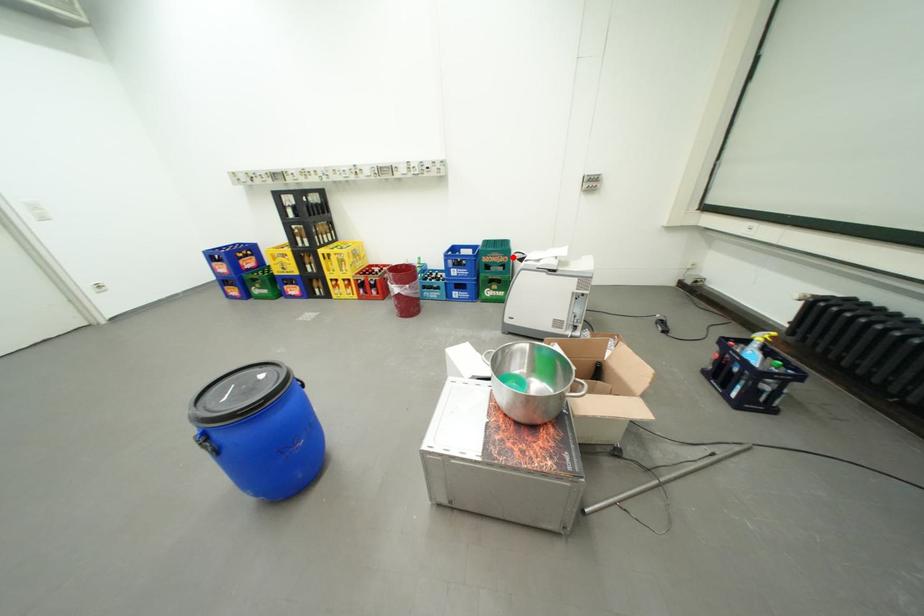
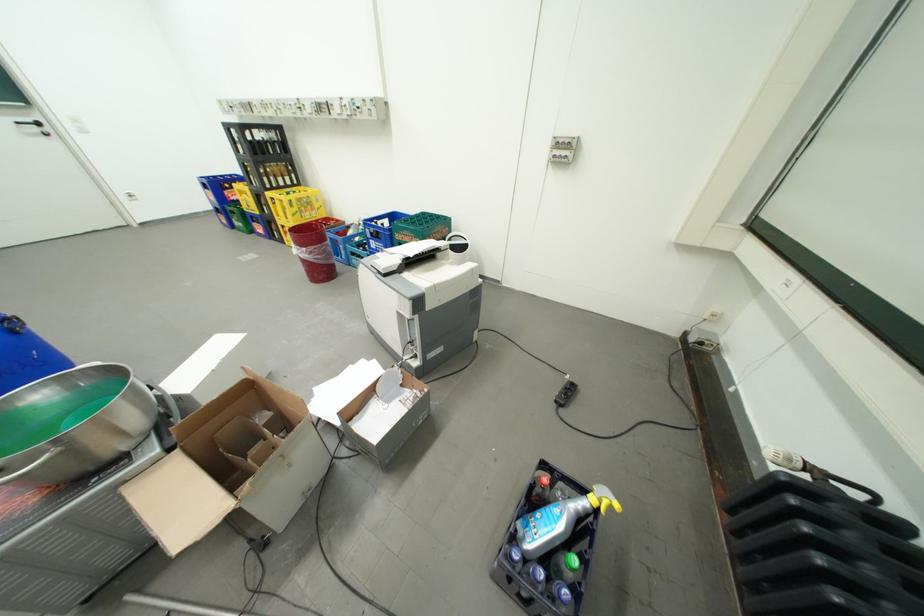
Question: I am providing you with two images of the same scene from different viewpoints. Given a red point in image1, look at the same physical point in image2. Is it:

Choices:
 (A) Closer to the viewpoint
 (B) Farther from the viewpoint

Answer: (B)